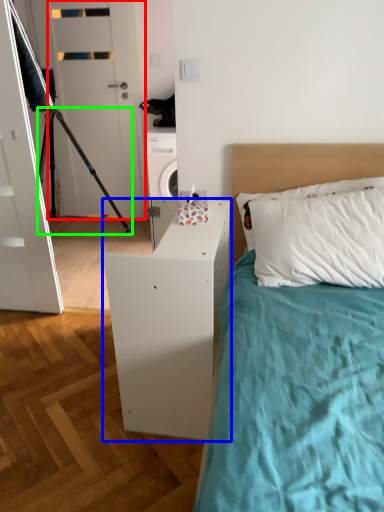
Question: Which is farther away from door (highlighted by a red box)? nightstand (highlighted by a blue box) or tripod (highlighted by a green box)?

Choices:
 (A) nightstand
 (B) tripod

Answer: (A)